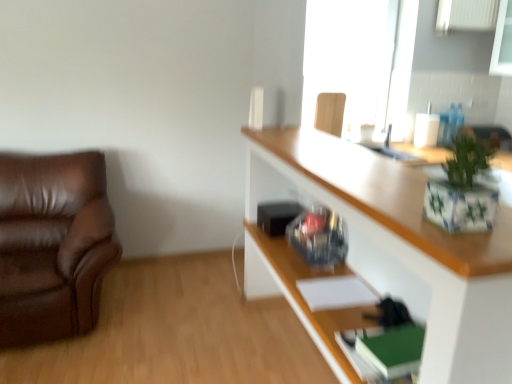
Image resolution: width=512 pixels, height=384 pixels. I want to click on free point in front of green ceramic pot at upper right, so click(470, 244).